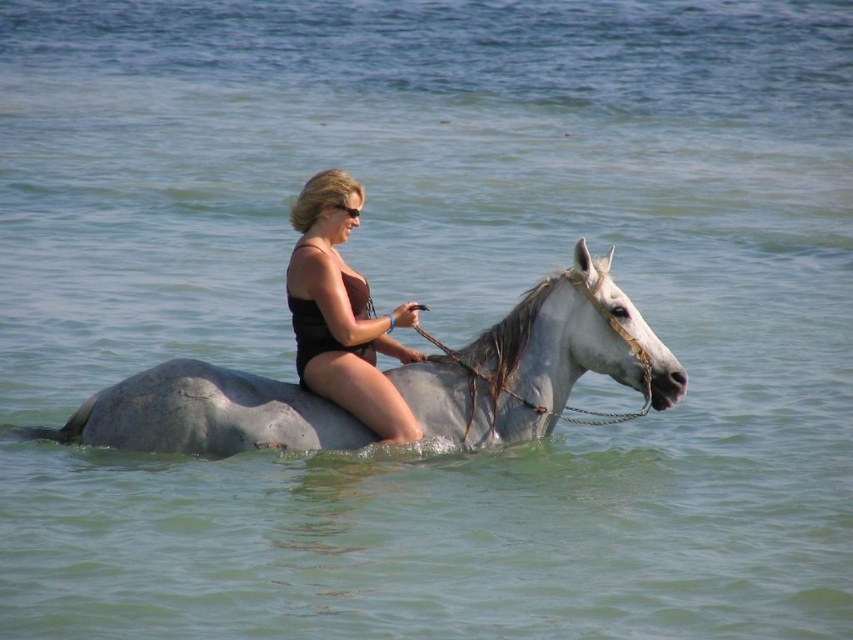
You are a photographer positioned at the edge of the water. You want to capture a photo of the black matte swimsuit at center and the white glossy horse at center such that the horse appears to the right of the swimsuit in the frame. Based on the scene, is this possible?

Yes, because the white glossy horse at center is already positioned to the right of the black matte swimsuit at center in the scene, so framing them this way is achievable.

Consider the image. You are a photographer aiming to capture the rider and horse in the water. Since the white glossy horse at center and the black matte swimsuit at center are both in the frame, which object is shorter in height?

The white glossy horse at center is not as tall as the black matte swimsuit at center, so the horse is shorter in height.